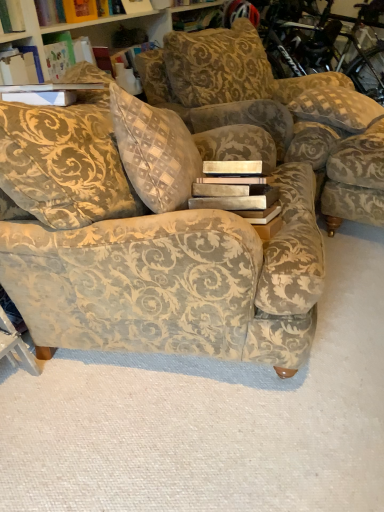
The height and width of the screenshot is (512, 384). Describe the element at coordinates (154, 259) in the screenshot. I see `velvet-patterned couch at center` at that location.

You are a GUI agent. You are given a task and a screenshot of the screen. Output one action in this format:
    pyautogui.click(x=<x>, y=<y>)
    Task: Click on the velvet floral armchair at right
    The width and height of the screenshot is (384, 512).
    Given the screenshot: What is the action you would take?
    pyautogui.click(x=356, y=179)

The height and width of the screenshot is (512, 384). In order to click on velvet-patterned couch at center in this screenshot , I will do `click(154, 259)`.

Is velvet floral armchair at right bigger or smaller than velvet-patterned couch at center?

Clearly, velvet floral armchair at right is smaller in size than velvet-patterned couch at center.

From a real-world perspective, is velvet floral armchair at right beneath velvet-patterned couch at center?

Indeed, from a real-world perspective, velvet floral armchair at right is positioned beneath velvet-patterned couch at center.

The width and height of the screenshot is (384, 512). I want to click on swivel chair that appears below the velvet-patterned couch at center (from a real-world perspective), so click(x=356, y=179).

Does point (352, 203) appear closer or farther from the camera than point (47, 219)?

Point (352, 203) is positioned farther from the camera compared to point (47, 219).

Considering the relative positions of checkered fabric pillow at upper right and velvet floral armchair at right in the image provided, is checkered fabric pillow at upper right to the left or to the right of velvet floral armchair at right?

checkered fabric pillow at upper right is positioned on velvet floral armchair at right's left side.

Considering the relative sizes of checkered fabric pillow at upper right and velvet floral armchair at right in the image provided, is checkered fabric pillow at upper right smaller than velvet floral armchair at right?

Yes.

Does checkered fabric pillow at upper right have a greater width compared to velvet floral armchair at right?

Yes.

Is checkered fabric pillow at upper right taller or shorter than velvet floral armchair at right?

Clearly, checkered fabric pillow at upper right is shorter compared to velvet floral armchair at right.

How much distance is there between velvet-patterned couch at center and velvet floral armchair at right?

31.82 inches.

Does velvet-patterned couch at center have a lesser height compared to velvet floral armchair at right?

No, velvet-patterned couch at center is not shorter than velvet floral armchair at right.

Does point (247, 294) lie behind point (328, 160)?

No.

Locate an element on the screen. The height and width of the screenshot is (512, 384). studio couch below the velvet floral armchair at right (from the image's perspective) is located at coordinates pos(154,259).

Would you say velvet-patterned couch at center contains checkered fabric pillow at upper right?

Definitely not — checkered fabric pillow at upper right is not inside velvet-patterned couch at center.

Considering the relative sizes of velvet-patterned couch at center and checkered fabric pillow at upper right in the image provided, is velvet-patterned couch at center shorter than checkered fabric pillow at upper right?

No.

Would you consider velvet-patterned couch at center to be distant from checkered fabric pillow at upper right?

Yes, velvet-patterned couch at center and checkered fabric pillow at upper right are quite far apart.

Where is `studio couch that is on the left side of checkered fabric pillow at upper right`? studio couch that is on the left side of checkered fabric pillow at upper right is located at coordinates (154, 259).

Which is in front, velvet floral armchair at right or checkered fabric pillow at upper right?

Positioned in front is velvet floral armchair at right.

Is velvet floral armchair at right far away from checkered fabric pillow at upper right?

Actually, velvet floral armchair at right and checkered fabric pillow at upper right are a little close together.

How different are the orientations of velvet floral armchair at right and checkered fabric pillow at upper right in degrees?

The facing directions of velvet floral armchair at right and checkered fabric pillow at upper right are 0.0884 degrees apart.

Is checkered fabric pillow at upper right at the left side of velvet-patterned couch at center?

No, checkered fabric pillow at upper right is not to the left of velvet-patterned couch at center.

Based on their sizes in the image, would you say checkered fabric pillow at upper right is bigger or smaller than velvet-patterned couch at center?

In the image, checkered fabric pillow at upper right appears to be smaller than velvet-patterned couch at center.

Choose the correct answer: Is checkered fabric pillow at upper right inside velvet-patterned couch at center or outside it?

checkered fabric pillow at upper right exists outside the volume of velvet-patterned couch at center.

Is velvet-patterned couch at center at the back of checkered fabric pillow at upper right?

checkered fabric pillow at upper right is not turned away from velvet-patterned couch at center.

This screenshot has height=512, width=384. Identify the location of swivel chair that appears on the right of velvet-patterned couch at center. (356, 179).

Locate an element on the screen. This screenshot has width=384, height=512. pillow behind the velvet floral armchair at right is located at coordinates (336, 108).

From the image, which object appears to be farther from velvet floral armchair at right, checkered fabric pillow at upper right or velvet-patterned couch at center?

velvet-patterned couch at center is further to velvet floral armchair at right.

Estimate the real-world distances between objects in this image. Which object is further from velvet-patterned couch at center, checkered fabric pillow at upper right or velvet floral armchair at right?

checkered fabric pillow at upper right lies further to velvet-patterned couch at center than the other object.

Looking at this image, when comparing their distances from velvet floral armchair at right, does velvet-patterned couch at center or checkered fabric pillow at upper right seem further?

velvet-patterned couch at center.

When comparing their distances from checkered fabric pillow at upper right, does velvet-patterned couch at center or velvet floral armchair at right seem closer?

Among the two, velvet floral armchair at right is located nearer to checkered fabric pillow at upper right.

When comparing their distances from velvet-patterned couch at center, does velvet floral armchair at right or checkered fabric pillow at upper right seem further?

The object further to velvet-patterned couch at center is checkered fabric pillow at upper right.

Based on their spatial positions, is velvet floral armchair at right or velvet-patterned couch at center closer to checkered fabric pillow at upper right?

velvet floral armchair at right lies closer to checkered fabric pillow at upper right than the other object.

The height and width of the screenshot is (512, 384). Identify the location of pillow between velvet-patterned couch at center and velvet floral armchair at right. 336,108.